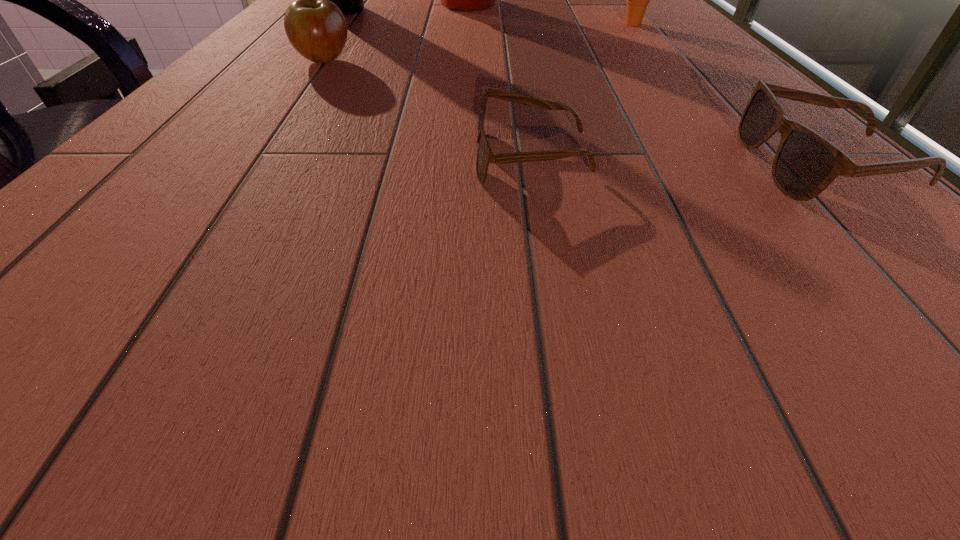
You are a GUI agent. You are given a task and a screenshot of the screen. Output one action in this format:
    pyautogui.click(x=<x>, y=<y>)
    Task: Click on the left sunglasses
    
    Given the screenshot: What is the action you would take?
    pyautogui.click(x=485, y=155)

At what (x,y) coordinates should I click in order to perform the action: click on the shortest object. Please return your answer as a coordinate pair (x, y). Image resolution: width=960 pixels, height=540 pixels. Looking at the image, I should click on (485, 155).

I want to click on the fourth shortest object, so click(x=637, y=0).

Where is `the fourth nearest object`? Image resolution: width=960 pixels, height=540 pixels. the fourth nearest object is located at coordinates (637, 0).

You are a GUI agent. You are given a task and a screenshot of the screen. Output one action in this format:
    pyautogui.click(x=<x>, y=<y>)
    Task: Click on the third nearest object
    
    Given the screenshot: What is the action you would take?
    pyautogui.click(x=316, y=28)

Locate an element on the screen. the third shortest object is located at coordinates (316, 28).

Where is `the second tallest object`? This screenshot has width=960, height=540. the second tallest object is located at coordinates (350, 0).

The height and width of the screenshot is (540, 960). I want to click on free spot located on the frames of the shortest object, so click(195, 157).

The width and height of the screenshot is (960, 540). I want to click on blank area located on the frames of the shortest object, so click(289, 157).

At what (x,y) coordinates should I click in order to perform the action: click on vacant space located on the frames of the shortest object. Please return your answer as a coordinate pair (x, y). Looking at the image, I should click on (398, 157).